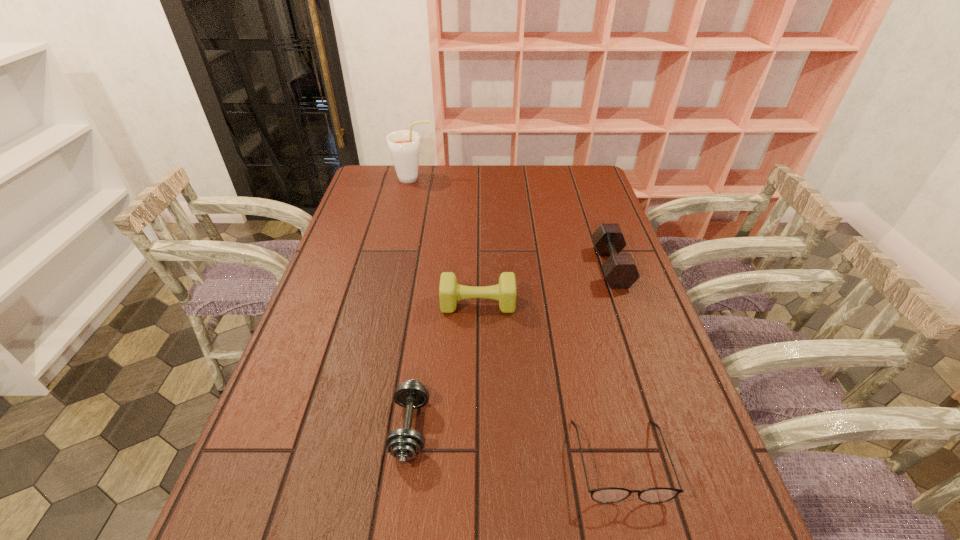
I want to click on vacant point located between the third farthest object and the farthest object, so click(445, 241).

Select which object appears as the third closest to the fourth nearest object. Please provide its 2D coordinates. Your answer should be formatted as a tuple, i.e. [(x, y)], where the tuple contains the x and y coordinates of a point satisfying the conditions above.

[(404, 444)]

In order to click on object that is the nearest to the tallest object in this screenshot , I will do `click(450, 292)`.

Locate an element on the screen. Image resolution: width=960 pixels, height=540 pixels. dumbbell that can be found as the second closest to the shortest object is located at coordinates (450, 292).

Find the location of a particular element. The height and width of the screenshot is (540, 960). dumbbell that is the second closest to the second nearest dumbbell is located at coordinates (620, 270).

You are a GUI agent. You are given a task and a screenshot of the screen. Output one action in this format:
    pyautogui.click(x=<x>, y=<y>)
    Task: Click on the free region that satisfies the following two spatial constraints: 1. on the drink side of the farthest object; 2. on the right side of the third nearest object
    This screenshot has height=540, width=960.
    Given the screenshot: What is the action you would take?
    pyautogui.click(x=384, y=304)

This screenshot has width=960, height=540. I want to click on blank area in the image that satisfies the following two spatial constraints: 1. on the drink side of the farthest object; 2. on the right side of the third nearest object, so click(384, 304).

You are a GUI agent. You are given a task and a screenshot of the screen. Output one action in this format:
    pyautogui.click(x=<x>, y=<y>)
    Task: Click on the vacant space that satisfies the following two spatial constraints: 1. on the drink side of the root beer; 2. on the left side of the farthest dumbbell
    The width and height of the screenshot is (960, 540).
    Given the screenshot: What is the action you would take?
    tap(393, 267)